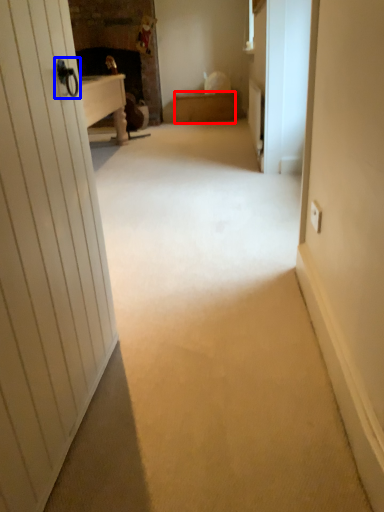
Question: Which object appears closest to the camera in this image, furniture (highlighted by a red box) or door handle (highlighted by a blue box)?

Choices:
 (A) furniture
 (B) door handle

Answer: (A)